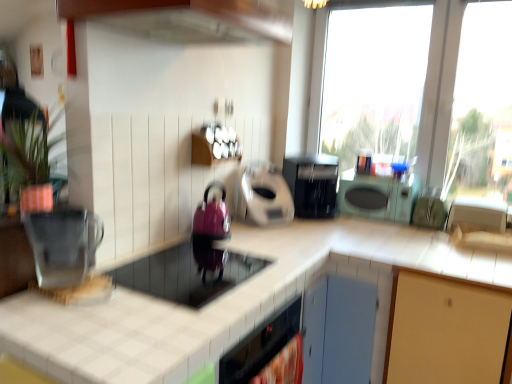
Question: In terms of width, does transparent glass window at upper right look wider or thinner when compared to metallic silver kettle at left, marked as the 5th appliance in a right-to-left arrangement?

Choices:
 (A) thin
 (B) wide

Answer: (A)

Question: Considering their positions, is transparent glass window at upper right located in front of or behind metallic silver kettle at left, which is the first appliance from left to right?

Choices:
 (A) front
 (B) behind

Answer: (B)

Question: Based on their relative distances, which object is farther from the matte pink kettle at center, the third appliance viewed from the left?

Choices:
 (A) metallic silver kettle at left, which is the first appliance from left to right
 (B) green matte plant at upper left
 (C) metallic silver toaster at right, positioned as the 1th appliance in right-to-left order
 (D) black plastic coffee maker at center
 (E) white matte toaster at center, the 4th appliance from the left

Answer: (C)

Question: Which object is the closest to the green matte microwave at center?

Choices:
 (A) transparent glass window at upper right
 (B) green matte plant at upper left
 (C) shiny black kettle at center, positioned as the second appliance in left-to-right order
 (D) white matte toaster at center, the second appliance positioned from the right
 (E) metallic silver kettle at left, marked as the 5th appliance in a right-to-left arrangement

Answer: (A)